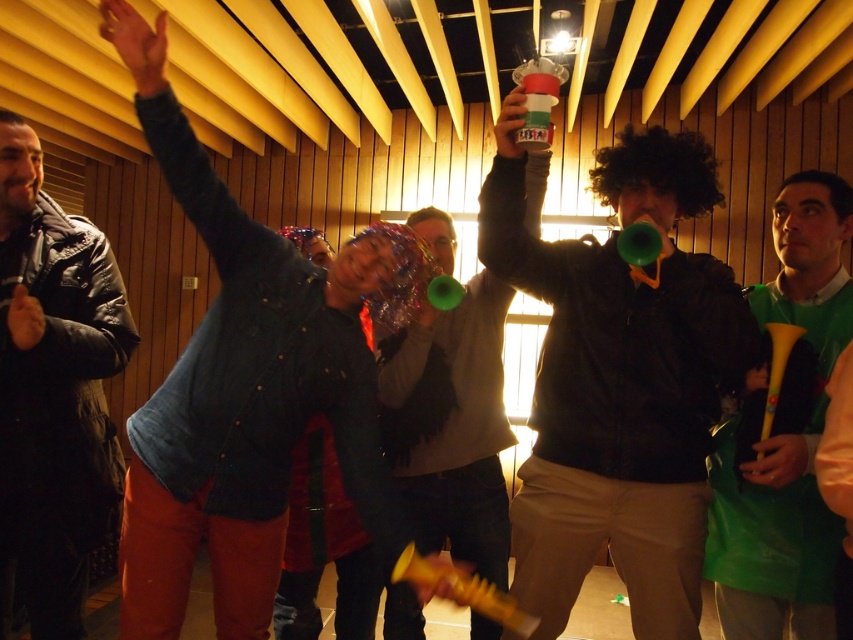
Can you confirm if matte black jacket at center is positioned below leather jacket at left?

No, matte black jacket at center is not below leather jacket at left.

Consider the image. Between matte black jacket at center and leather jacket at left, which one appears on the right side from the viewer's perspective?

From the viewer's perspective, matte black jacket at center appears more on the right side.

You are a GUI agent. You are given a task and a screenshot of the screen. Output one action in this format:
    pyautogui.click(x=<x>, y=<y>)
    Task: Click on the matte black jacket at center
    The width and height of the screenshot is (853, 640).
    Given the screenshot: What is the action you would take?
    pyautogui.click(x=618, y=381)

Describe the element at coordinates (239, 388) in the screenshot. I see `denim jacket at center` at that location.

Is denim jacket at center smaller than shiny green horn at center?

Actually, denim jacket at center might be larger than shiny green horn at center.

Locate an element on the screen. This screenshot has width=853, height=640. denim jacket at center is located at coordinates (239, 388).

Can you confirm if leather jacket at left is thinner than shiny green horn at center?

Correct, leather jacket at left's width is less than shiny green horn at center's.

Between point (96, 484) and point (453, 404), which one is positioned in front?

Point (96, 484)

This screenshot has height=640, width=853. I want to click on leather jacket at left, so coord(53,390).